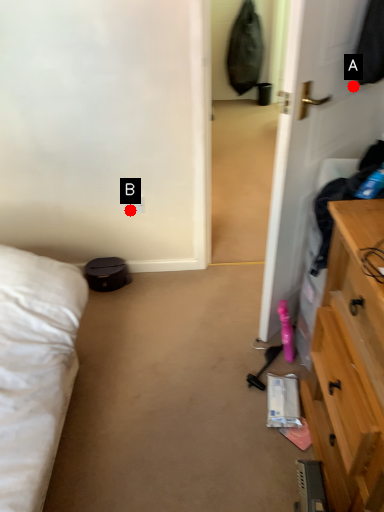
Question: Two points are circled on the image, labeled by A and B beside each circle. Which point is closer to the camera taking this photo?

Choices:
 (A) A is closer
 (B) B is closer

Answer: (A)